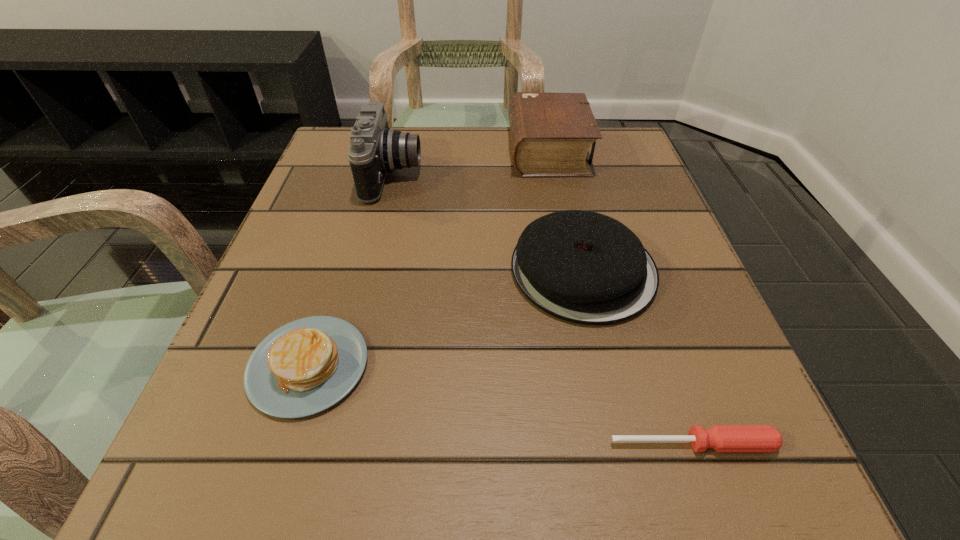
I want to click on the tallest object, so click(x=375, y=149).

This screenshot has height=540, width=960. What are the coordinates of `Bible` in the screenshot? It's located at (550, 133).

Identify the location of the right pancake. (584, 267).

Locate an element on the screen. the taller pancake is located at coordinates coord(584,267).

Locate an element on the screen. This screenshot has height=540, width=960. the left pancake is located at coordinates (304, 367).

Find the location of a particular element. Image resolution: width=960 pixels, height=540 pixels. the second shortest object is located at coordinates (304, 367).

I want to click on the nearest object, so click(x=722, y=438).

At what (x,y) coordinates should I click in order to perform the action: click on screwdriver. Please return your answer as a coordinate pair (x, y). Looking at the image, I should click on (722, 438).

Locate an element on the screen. The height and width of the screenshot is (540, 960). blank area located 0.360m on the front-facing side of the camera is located at coordinates (591, 175).

This screenshot has height=540, width=960. Identify the location of vacant space located 0.100m on the spine side of the Bible. (465, 151).